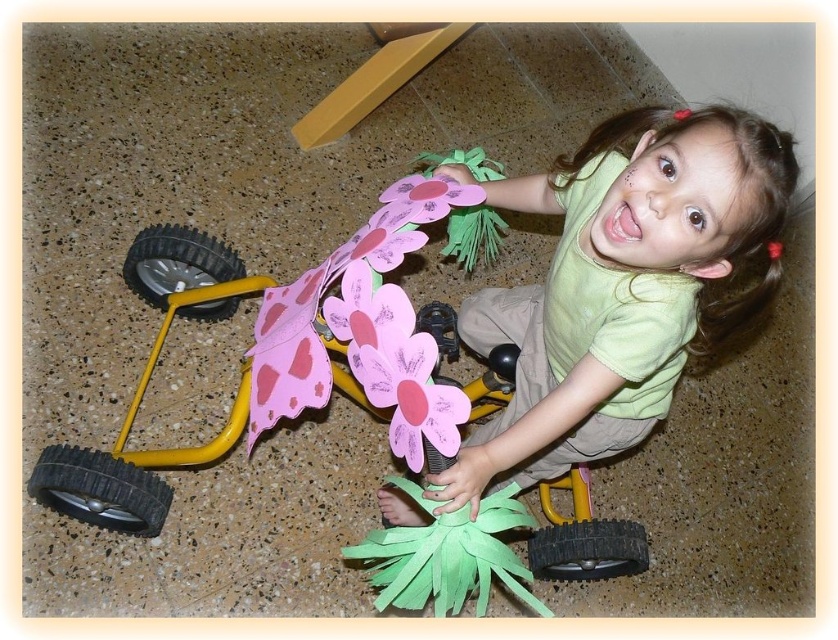
You are a parent trying to find your child a toy car. You see the green matte shirt at upper center and the yellow plastic toy car at lower left. Which object is closer to you from your viewpoint?

The green matte shirt at upper center is in front of the yellow plastic toy car at lower left, so the green matte shirt at upper center is closer to you.

You are a parent trying to organize your childroom. You want to place the green matte shirt at upper center on a shelf above the yellow plastic toy car at lower left. Is the shirt currently positioned to the right or left of the toy car?

The green matte shirt at upper center is positioned on the right side of yellow plastic toy car at lower left, so the shirt is currently to the right of the toy car.

You are a robot trying to reach a specific location in the room. You are currently at point (732, 168). There is another point at (471, 230). According to the image, which point is closer to you?

Point (732, 168) is in front of point (471, 230), so the point you are currently at is closer to you.